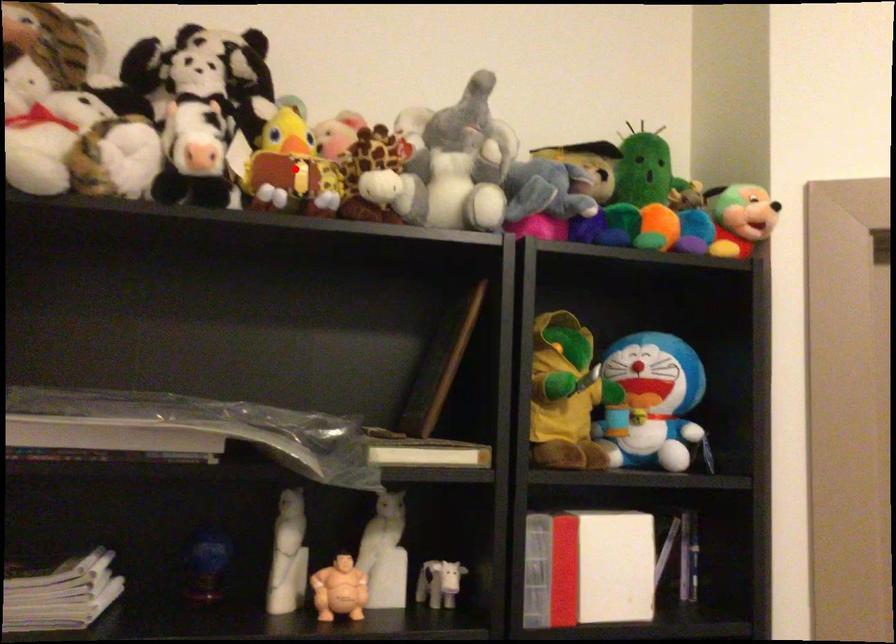
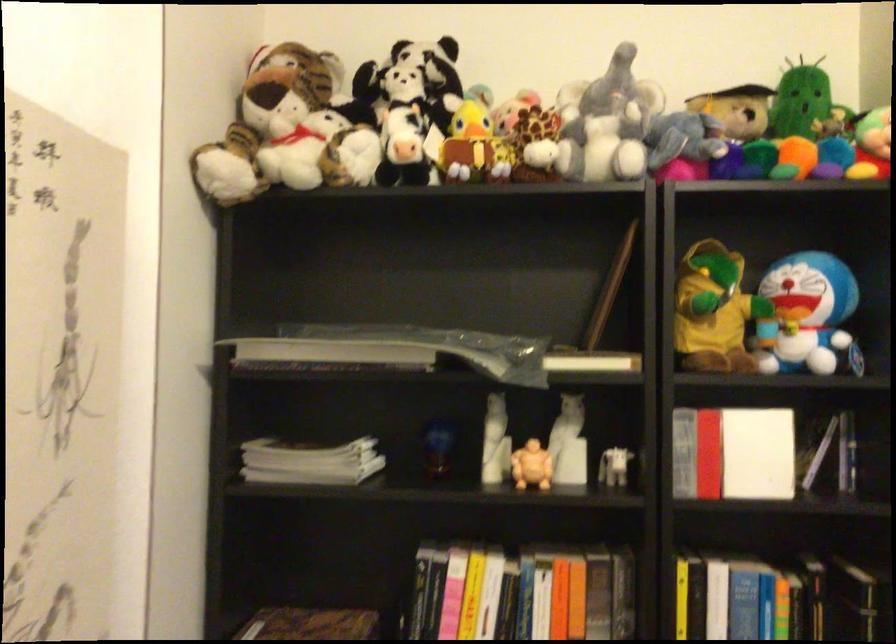
Question: I am providing you with two images of the same scene from different viewpoints. A red point is marked on the first image. At the location where the point appears in image 1, is it still visible in image 2?

Choices:
 (A) Yes
 (B) No

Answer: (A)